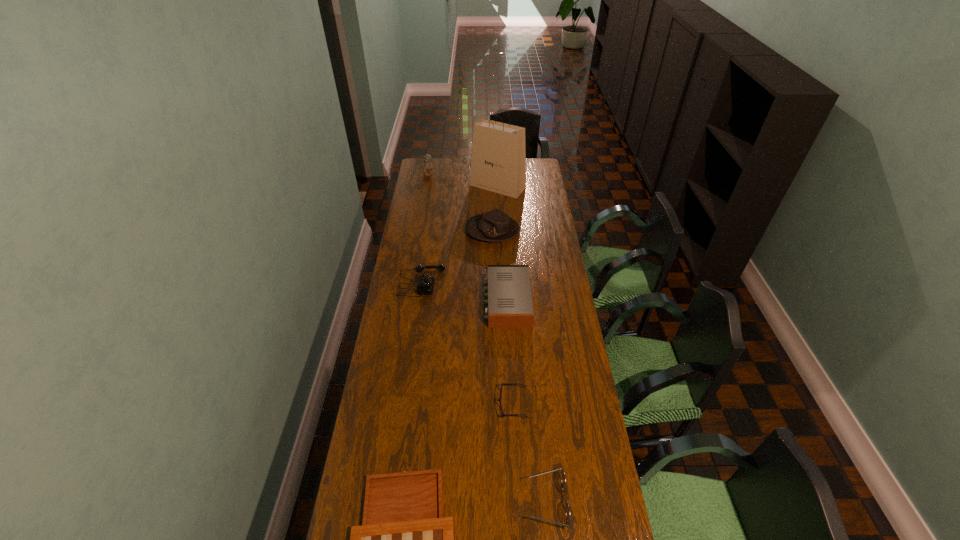
In order to click on spectacles located at the right edge in this screenshot , I will do `click(568, 515)`.

Image resolution: width=960 pixels, height=540 pixels. I want to click on object located in the far left corner section of the desktop, so click(x=426, y=166).

Where is `object present at the far right corner`? object present at the far right corner is located at coordinates (498, 164).

Locate an element on the screen. vacant position at the far edge of the desktop is located at coordinates (444, 176).

You are a GUI agent. You are given a task and a screenshot of the screen. Output one action in this format:
    pyautogui.click(x=<x>, y=<y>)
    Task: Click on the vacant region at the left edge of the desktop
    Image resolution: width=960 pixels, height=540 pixels.
    Given the screenshot: What is the action you would take?
    pyautogui.click(x=434, y=216)

Locate an element on the screen. vacant area at the right edge of the desktop is located at coordinates (543, 209).

You are a GUI agent. You are given a task and a screenshot of the screen. Output one action in this format:
    pyautogui.click(x=<x>, y=<y>)
    Task: Click on the blank space at the far left corner of the desktop
    
    Given the screenshot: What is the action you would take?
    pyautogui.click(x=434, y=165)

The width and height of the screenshot is (960, 540). I want to click on unoccupied position between the shopping bag and the sixth nearest object, so click(x=495, y=208).

Identify the location of vacant space that's between the seventh shortest object and the shopping bag. (464, 180).

Where is `blank region between the radio receiver and the teddy bear`? blank region between the radio receiver and the teddy bear is located at coordinates [468, 237].